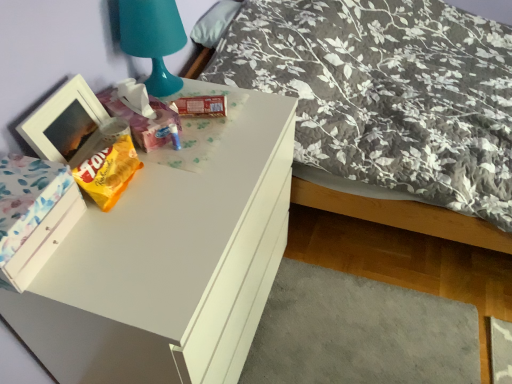
At what (x,y) coordinates should I click in order to perform the action: click on unoccupied region to the right of white matte picture frame at left. Please return your answer as a coordinate pair (x, y). Looking at the image, I should click on (168, 172).